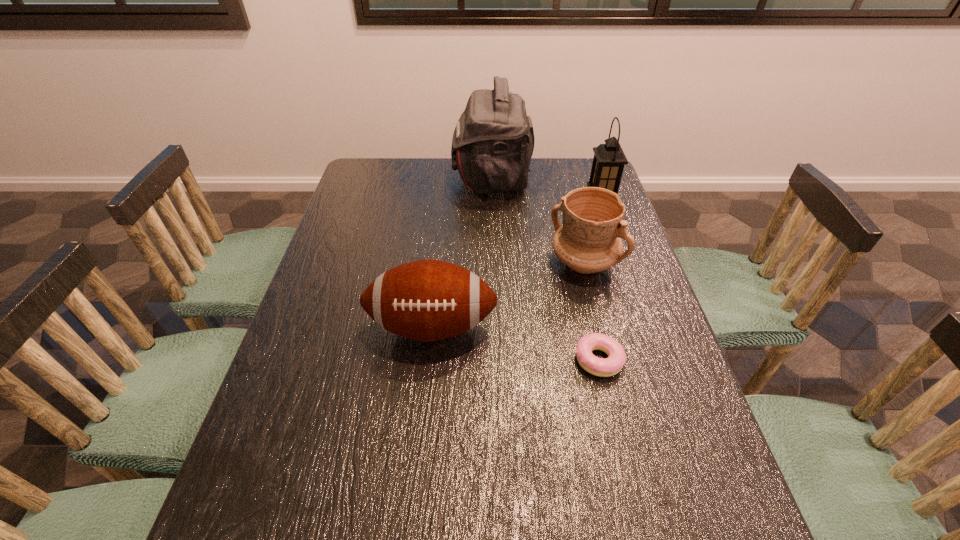
Locate an element on the screen. The width and height of the screenshot is (960, 540). shoulder bag is located at coordinates point(493,142).

This screenshot has height=540, width=960. Find the location of `lantern`. lantern is located at coordinates click(x=609, y=160).

You are a GUI agent. You are given a task and a screenshot of the screen. Output one action in this format:
    pyautogui.click(x=<x>, y=<y>)
    Task: Click on the pottery
    The height and width of the screenshot is (540, 960).
    Given the screenshot: What is the action you would take?
    pyautogui.click(x=589, y=240)

Locate an element on the screen. Image resolution: width=960 pixels, height=540 pixels. football is located at coordinates (427, 300).

Identify the location of doughnut. (603, 367).

I want to click on blank space located on the open flap of the shoulder bag, so click(x=433, y=179).

This screenshot has width=960, height=540. What are the coordinates of `vacant area situated 0.160m on the open flap of the shoulder bag` in the screenshot? It's located at (407, 179).

The width and height of the screenshot is (960, 540). What are the coordinates of `free region located on the open flap of the shoulder bag` in the screenshot? It's located at (353, 179).

You are a GUI agent. You are given a task and a screenshot of the screen. Output one action in this format:
    pyautogui.click(x=<x>, y=<y>)
    Task: Click on the vacant region located on the front of the second tallest object
    This screenshot has height=540, width=960.
    Given the screenshot: What is the action you would take?
    pyautogui.click(x=616, y=245)

I want to click on vacant space positioned on the back of the third nearest object, so (575, 226).